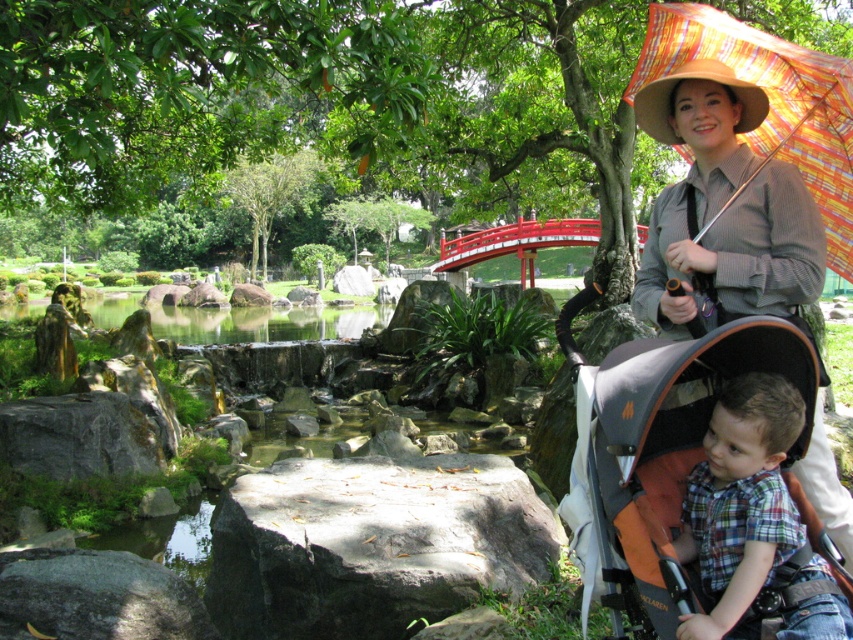
Question: Which is farther from the matte brown shirt at upper right?

Choices:
 (A) plaid cotton shirt at lower right
 (B) multicolored woven umbrella at upper right

Answer: (A)

Question: Observing the image, what is the correct spatial positioning of matte brown shirt at upper right in reference to orange fabric stroller at lower right?

Choices:
 (A) below
 (B) above

Answer: (B)

Question: Does matte brown shirt at upper right appear over multicolored woven umbrella at upper right?

Choices:
 (A) yes
 (B) no

Answer: (B)

Question: Is plaid cotton shirt at lower right thinner than multicolored woven umbrella at upper right?

Choices:
 (A) no
 (B) yes

Answer: (B)

Question: Which object is farther from the camera taking this photo?

Choices:
 (A) green smooth water at center
 (B) multicolored woven umbrella at upper right
 (C) plaid cotton shirt at lower right

Answer: (A)

Question: Which point appears closest to the camera in this image?

Choices:
 (A) (631, 496)
 (B) (851, 92)
 (C) (131, 301)

Answer: (A)